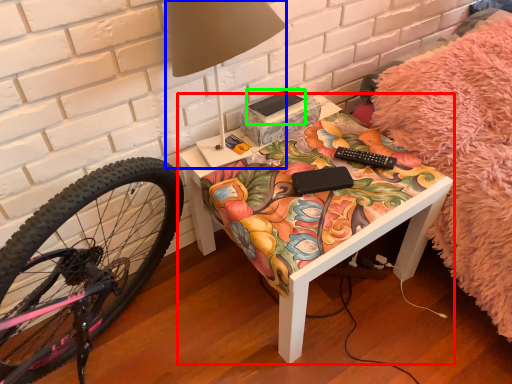
Question: Estimate the real-world distances between objects in this image. Which object is farther from table (highlighted by a red box), table lamp (highlighted by a blue box) or book (highlighted by a green box)?

Choices:
 (A) table lamp
 (B) book

Answer: (A)